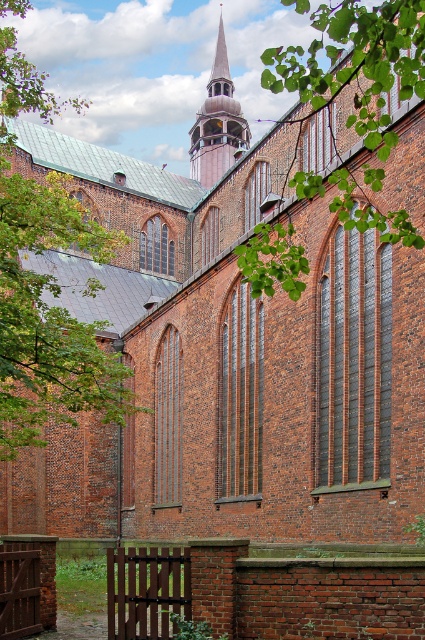
Question: Where is green leafy tree at left located in relation to green leafy branch at upper center in the image?

Choices:
 (A) right
 (B) left

Answer: (B)

Question: Which of the following is the closest to the observer?

Choices:
 (A) (25, 1)
 (B) (226, 157)

Answer: (A)

Question: Which is nearer to the wooden spire at center?

Choices:
 (A) green leafy branch at upper center
 (B) green leafy tree at left

Answer: (A)

Question: In this image, where is green leafy branch at upper center located relative to wooden spire at center?

Choices:
 (A) below
 (B) above

Answer: (B)

Question: Does green leafy branch at upper center have a lesser width compared to wooden spire at center?

Choices:
 (A) yes
 (B) no

Answer: (B)

Question: Which point is closer to the camera?

Choices:
 (A) green leafy tree at left
 (B) green leafy branch at upper center
 (C) wooden spire at center

Answer: (B)